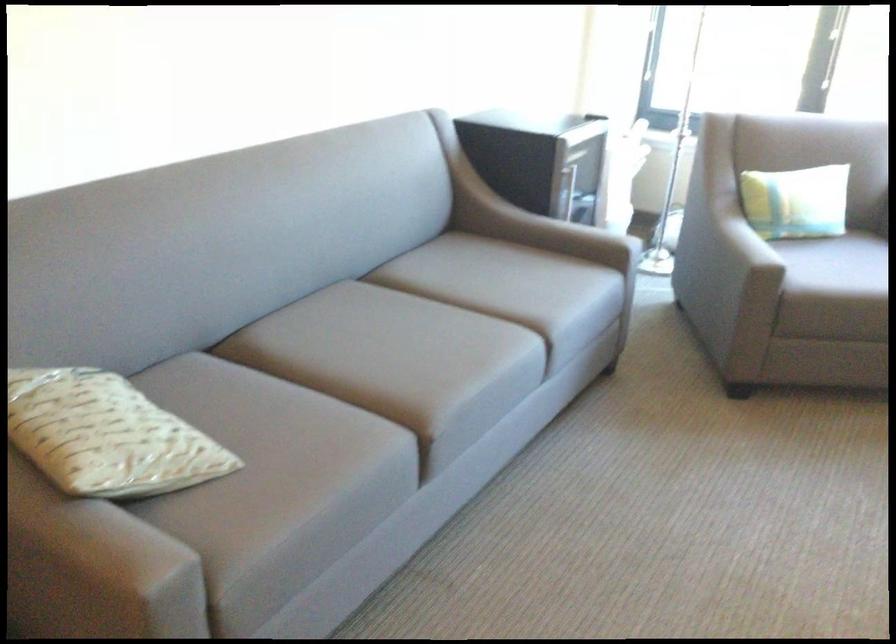
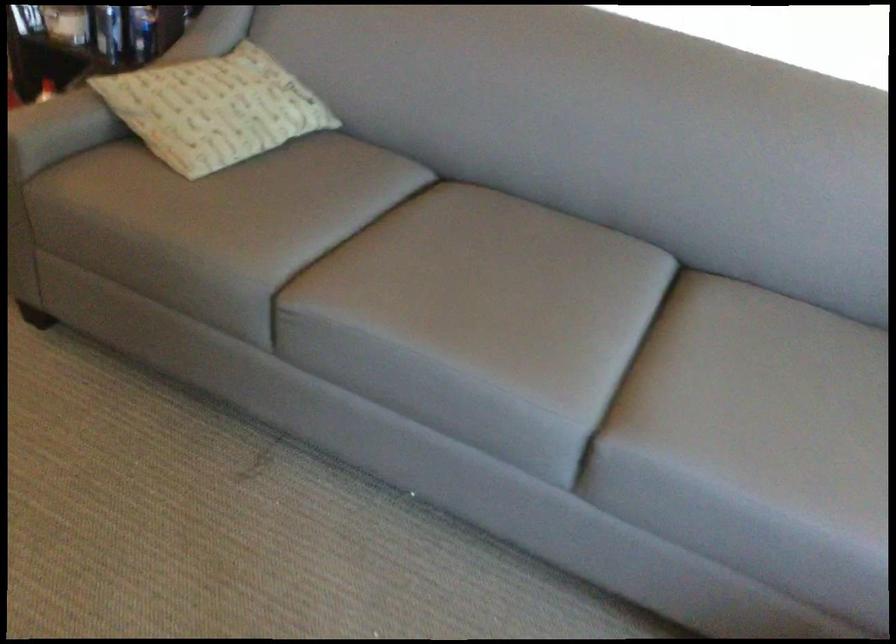
Locate, in the second image, the point that corresponds to point 88,420 in the first image.

(214, 93)